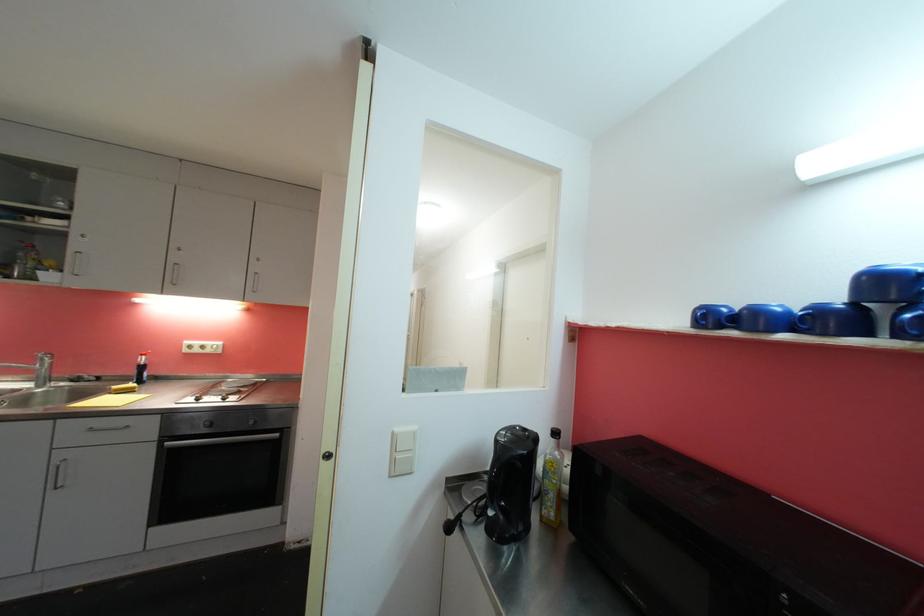
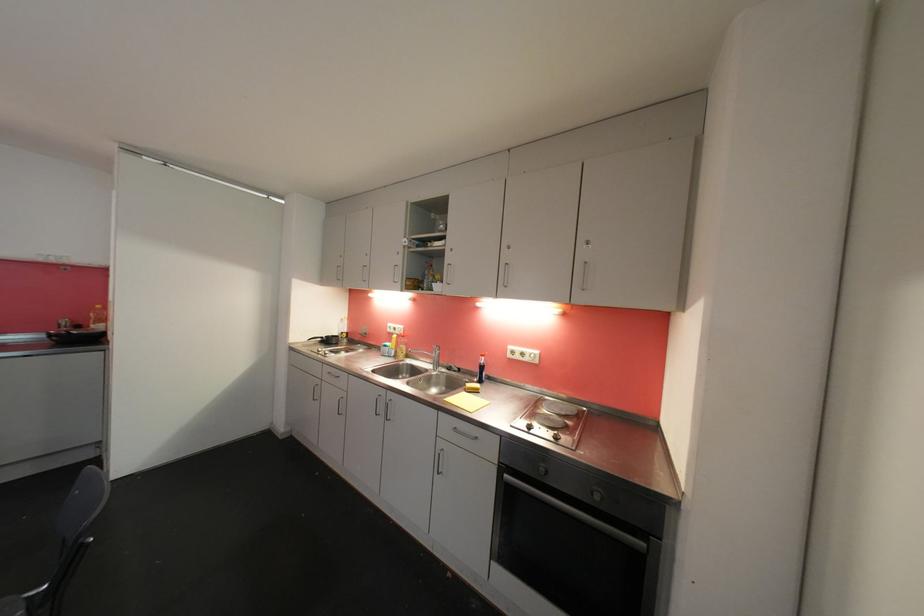
Question: The images are taken continuously from a first-person perspective. In which direction is your viewpoint rotating?

Choices:
 (A) Left
 (B) Right
 (C) Up
 (D) Down

Answer: (A)